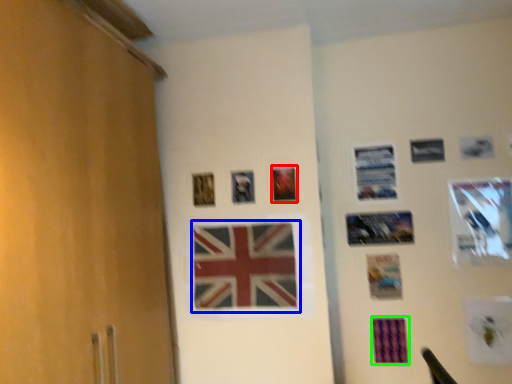
Question: Considering the real-world distances, which object is farthest from picture frame (highlighted by a red box)? flag (highlighted by a blue box) or postcard (highlighted by a green box)?

Choices:
 (A) flag
 (B) postcard

Answer: (B)